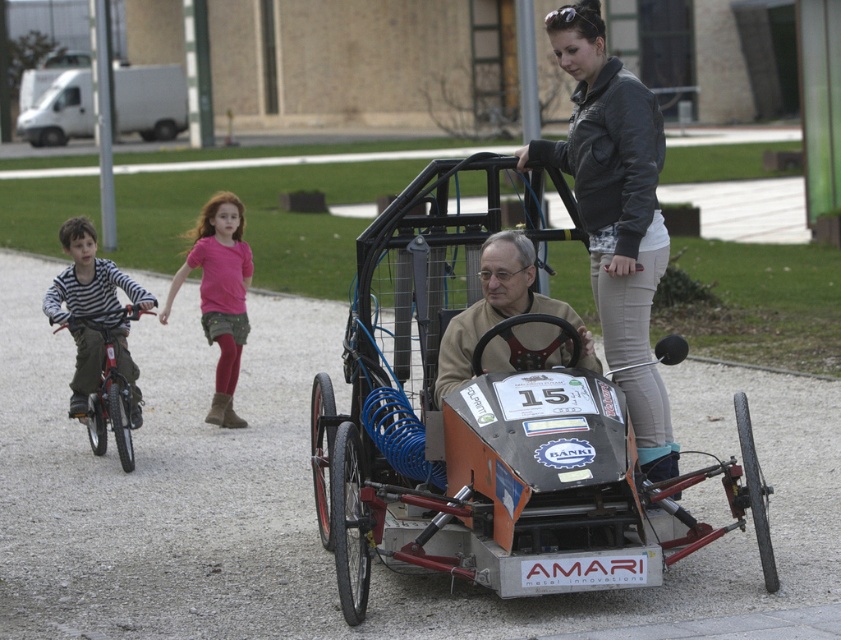
You are standing at the starting line of the race track. You see two points marked on the track ahead of you. The first point is at coordinates point (558, 316) and the second point is at coordinates point (136, 410). Which of these two points is closer to your current position?

Point (558, 316) is in front of point (136, 410), so the first point is closer to your current position.

You are standing at point (162, 97) and want to walk to point (426, 189). Which direction should you move?

You should move forward to reach point (426, 189) because it is in front of your current position at point (162, 97).